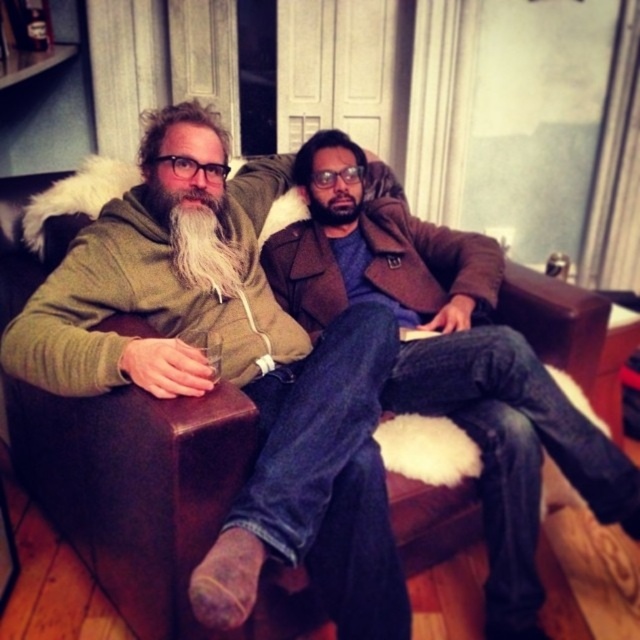
Can you confirm if brown leather couch at center is positioned below white fuzzy beard at left?

Yes, brown leather couch at center is below white fuzzy beard at left.

Which is in front, point (435, 486) or point (195, 234)?

Point (435, 486)

Between point (554, 296) and point (200, 262), which one is positioned behind?

Positioned behind is point (554, 296).

Find the location of a particular element. brown leather couch at center is located at coordinates (134, 486).